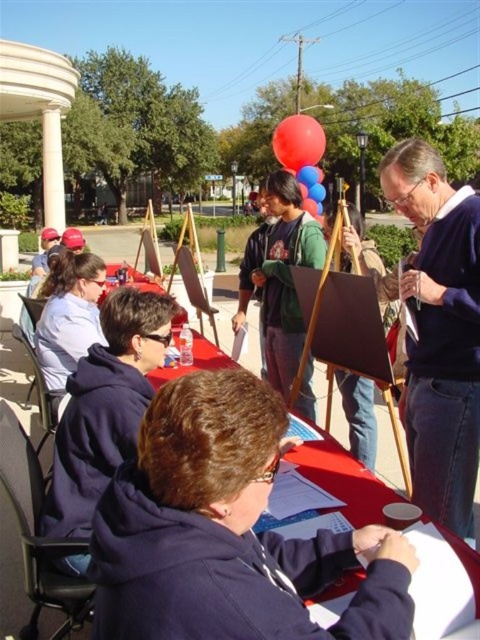
From the picture: You are organizing a community art event and need to ensure that all participants have enough space. The matte blue sweater at right and the green fleece jacket at center are two participants. Which participant is wearing a smaller garment?

The matte blue sweater at right is smaller than the green fleece jacket at center, so the participant wearing the matte blue sweater at right has a smaller garment.

Where is the matte blue sweater at right located in the image?

The matte blue sweater at right is located at the 2D coordinates point (440, 333) in the image.

You are a photographer standing in the park and want to capture a photo that includes both the matte blue sweater at right and the rubberized glossy balloon at upper center. Which object should you adjust your camera angle to focus on first to ensure both are in frame?

The matte blue sweater at right is not as tall as the rubberized glossy balloon at upper center, so you should focus on the taller rubberized glossy balloon at upper center first to ensure both are in frame.